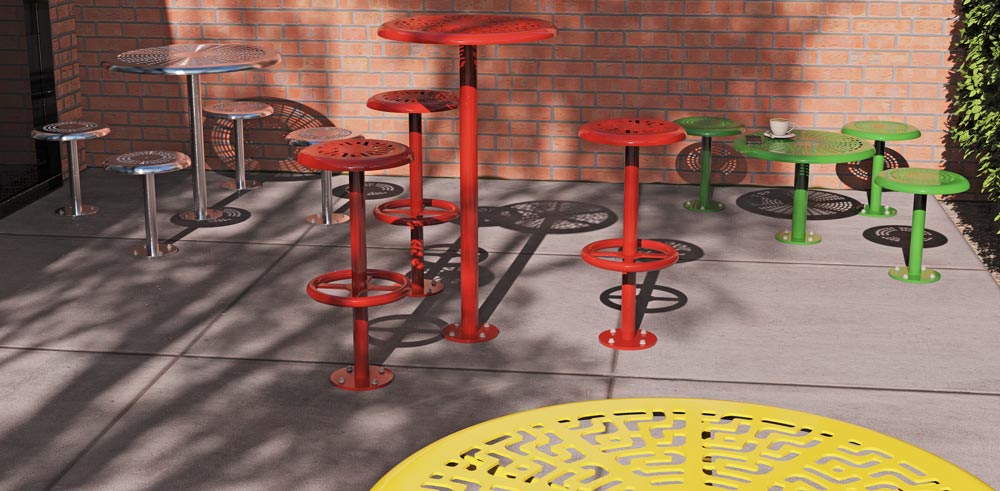
Where is `yellow circle table`? This screenshot has height=491, width=1000. yellow circle table is located at coordinates (692, 478).